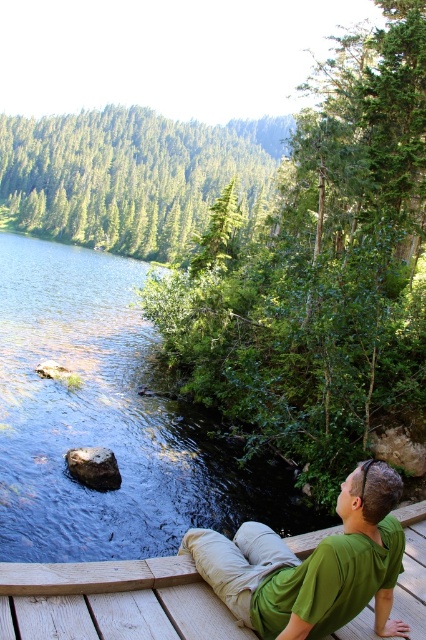
You are standing on the wooden deck where the man is relaxing. You want to find the clear water at lower left. According to the coordinates provided, where should you look to locate it?

The clear water at lower left is located at point (108, 420).